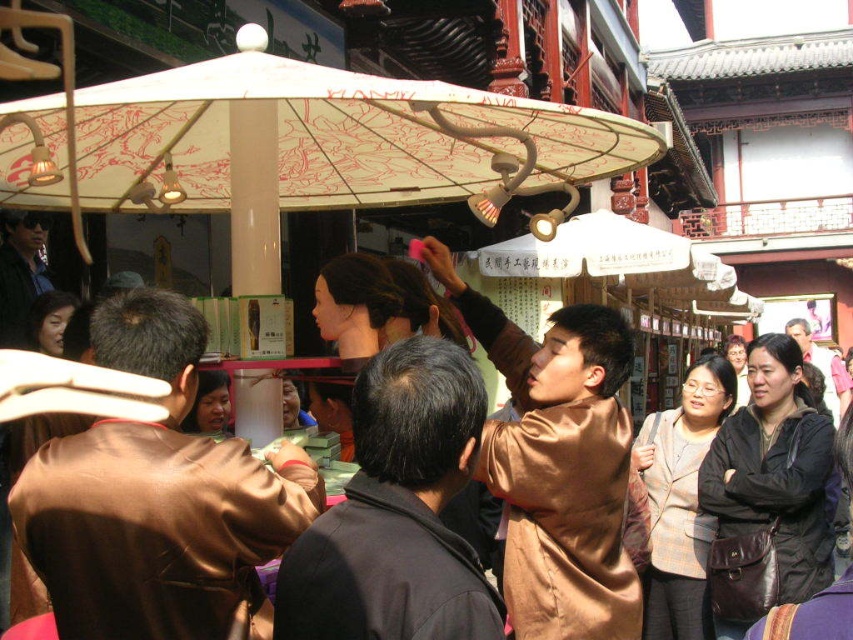
Question: Is white paper umbrella at upper center in front of brown leather bag at lower right?

Choices:
 (A) yes
 (B) no

Answer: (A)

Question: Which point is closer to the camera taking this photo?

Choices:
 (A) (386, 193)
 (B) (236, 582)

Answer: (B)

Question: Is black matte robe at center further to camera compared to brown satin robe at lower right?

Choices:
 (A) yes
 (B) no

Answer: (B)

Question: Can you confirm if brown leather bag at lower right is wider than brown satin robe at lower right?

Choices:
 (A) yes
 (B) no

Answer: (A)

Question: Which of the following is the closest to the observer?

Choices:
 (A) (392, 525)
 (B) (225, 524)

Answer: (B)

Question: Which of the following is the closest to the observer?

Choices:
 (A) brown satin robe at lower right
 (B) brown satin robe at center
 (C) black matte robe at center

Answer: (B)